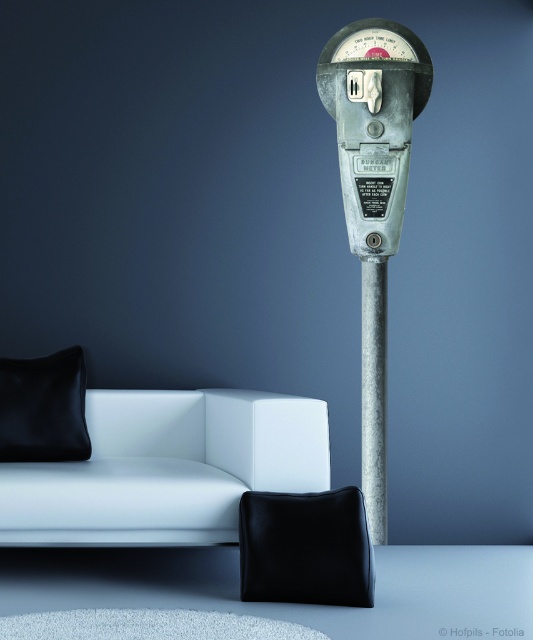
Question: Estimate the real-world distances between objects in this image. Which object is closer to the metallic parking meter at center?

Choices:
 (A) black leather cushion at lower center
 (B) white leather couch at lower left

Answer: (B)

Question: Is metallic parking meter at center thinner than black leather cushion at lower center?

Choices:
 (A) yes
 (B) no

Answer: (B)

Question: Which of these objects is positioned closest to the metallic parking meter at center?

Choices:
 (A) metallic textured pole at center
 (B) black leather cushion at lower center
 (C) white leather couch at lower left

Answer: (A)

Question: Does white leather couch at lower left have a lesser width compared to metallic textured pole at center?

Choices:
 (A) no
 (B) yes

Answer: (A)

Question: Which object is positioned farthest from the black leather cushion at lower center?

Choices:
 (A) white leather couch at lower left
 (B) metallic textured pole at center
 (C) metallic parking meter at center
 (D) black leather pillow at lower left

Answer: (C)

Question: Does metallic parking meter at center appear on the left side of black leather cushion at lower center?

Choices:
 (A) yes
 (B) no

Answer: (B)